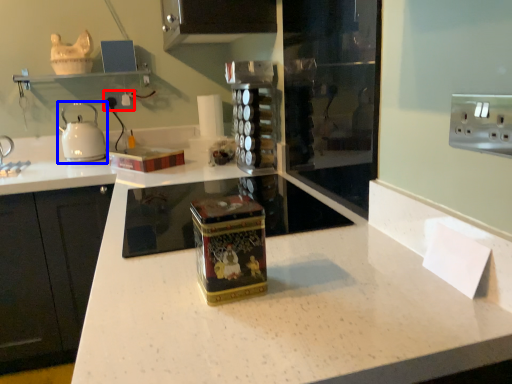
Question: Which object appears closest to the camera in this image, electric outlet (highlighted by a red box) or kitchen appliance (highlighted by a blue box)?

Choices:
 (A) electric outlet
 (B) kitchen appliance

Answer: (B)